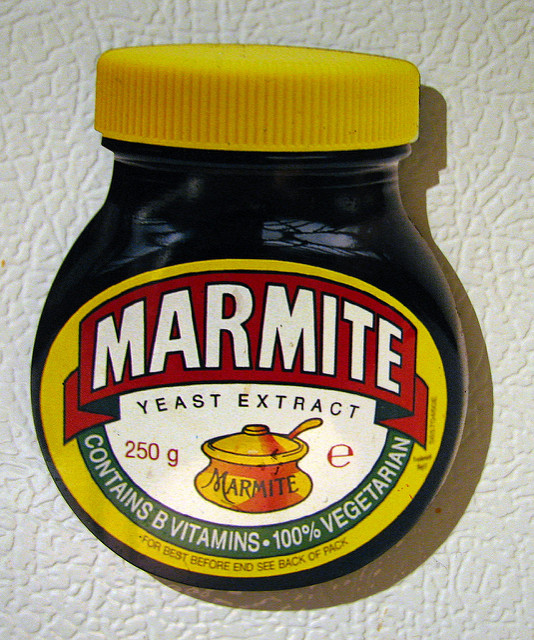
The width and height of the screenshot is (534, 640). What are the coordinates of `marmite refrigerator magnet` in the screenshot? It's located at point(438,283).